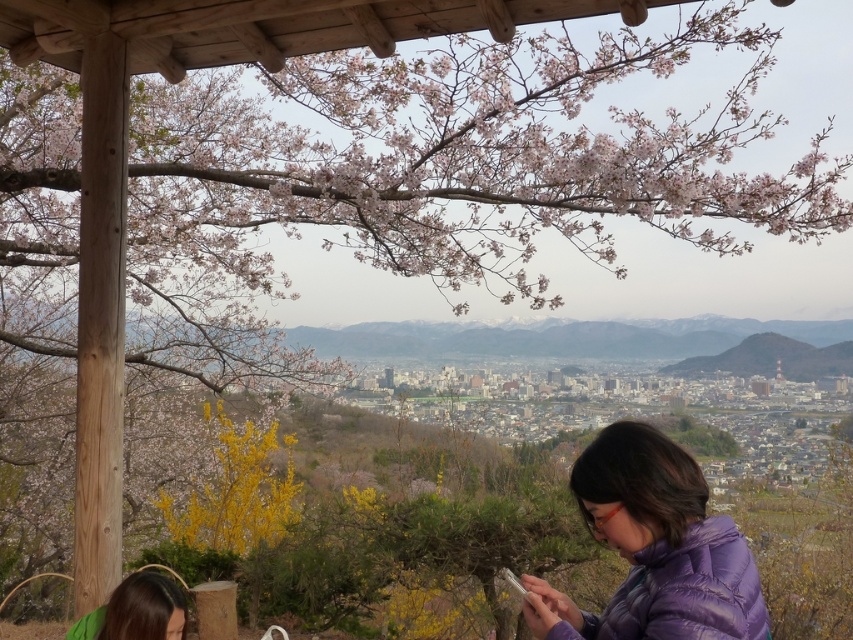
Who is positioned more to the left, purple down jacket at lower right or green fabric hair at lower left?

green fabric hair at lower left

Between point (589, 516) and point (93, 620), which one is positioned behind?

Positioned behind is point (93, 620).

Is point (595, 448) behind point (135, 634)?

No, it is in front of (135, 634).

Image resolution: width=853 pixels, height=640 pixels. Identify the location of purple down jacket at lower right. (654, 548).